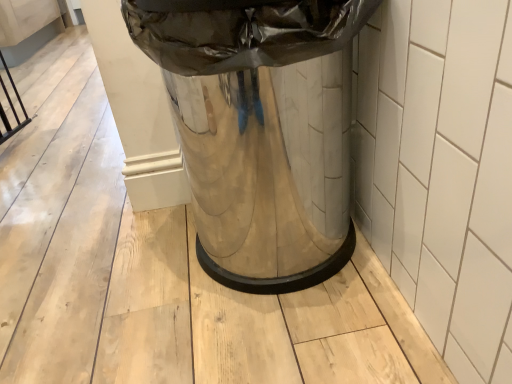
Question: Can you confirm if polished metallic trash can at center is shorter than white glossy tile at right?

Choices:
 (A) no
 (B) yes

Answer: (A)

Question: Can you confirm if polished metallic trash can at center is positioned to the right of white glossy tile at right?

Choices:
 (A) yes
 (B) no

Answer: (B)

Question: From the image's perspective, is polished metallic trash can at center under white glossy tile at right?

Choices:
 (A) yes
 (B) no

Answer: (B)

Question: Is polished metallic trash can at center bigger than white glossy tile at right?

Choices:
 (A) yes
 (B) no

Answer: (A)

Question: Is polished metallic trash can at center surrounding white glossy tile at right?

Choices:
 (A) no
 (B) yes

Answer: (A)

Question: Can you confirm if polished metallic trash can at center is positioned to the left of white glossy tile at right?

Choices:
 (A) no
 (B) yes

Answer: (B)

Question: Can you confirm if white glossy tile at right is shorter than polished metallic trash can at center?

Choices:
 (A) no
 (B) yes

Answer: (B)

Question: Does white glossy tile at right come in front of polished metallic trash can at center?

Choices:
 (A) yes
 (B) no

Answer: (A)

Question: Can you confirm if white glossy tile at right is positioned to the right of polished metallic trash can at center?

Choices:
 (A) yes
 (B) no

Answer: (A)

Question: Is white glossy tile at right bigger than polished metallic trash can at center?

Choices:
 (A) yes
 (B) no

Answer: (B)

Question: Could polished metallic trash can at center be considered to be inside white glossy tile at right?

Choices:
 (A) yes
 (B) no

Answer: (B)

Question: Does white glossy tile at right turn towards polished metallic trash can at center?

Choices:
 (A) no
 (B) yes

Answer: (B)

Question: Choose the correct answer: Is white glossy tile at right inside polished metallic trash can at center or outside it?

Choices:
 (A) inside
 (B) outside

Answer: (B)